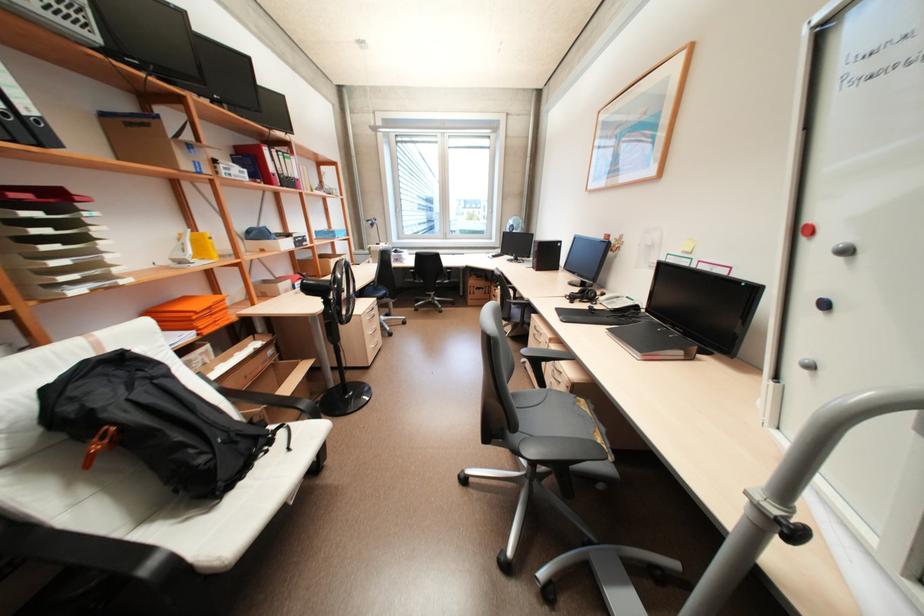
What do you see at coordinates (560, 450) in the screenshot? I see `the gray chair armrest` at bounding box center [560, 450].